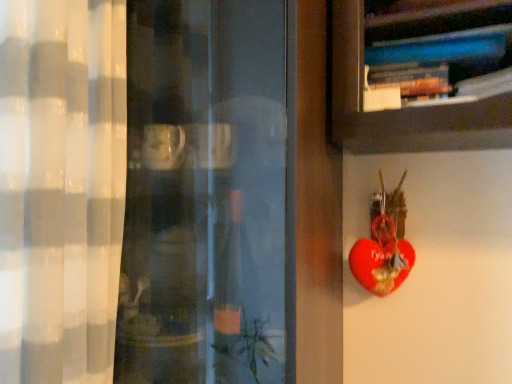
What do you see at coordinates (204, 194) in the screenshot? I see `transparent glass door at center` at bounding box center [204, 194].

Where is `transparent glass door at center`? transparent glass door at center is located at coordinates (204, 194).

Image resolution: width=512 pixels, height=384 pixels. Find the location of `transparent glass door at center`. transparent glass door at center is located at coordinates (204, 194).